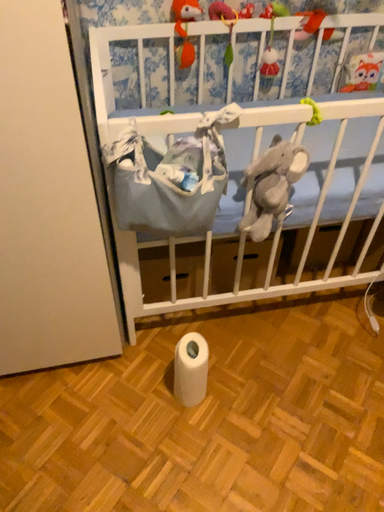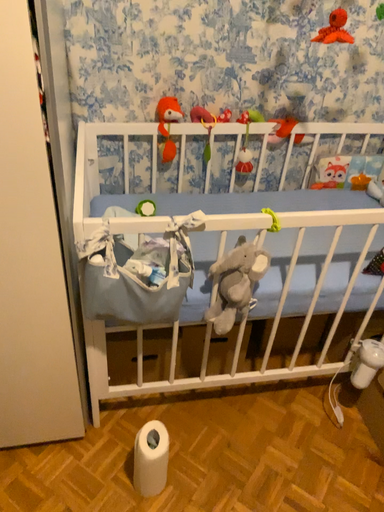
Question: Which way did the camera rotate in the video?

Choices:
 (A) rotated downward
 (B) rotated upward

Answer: (B)